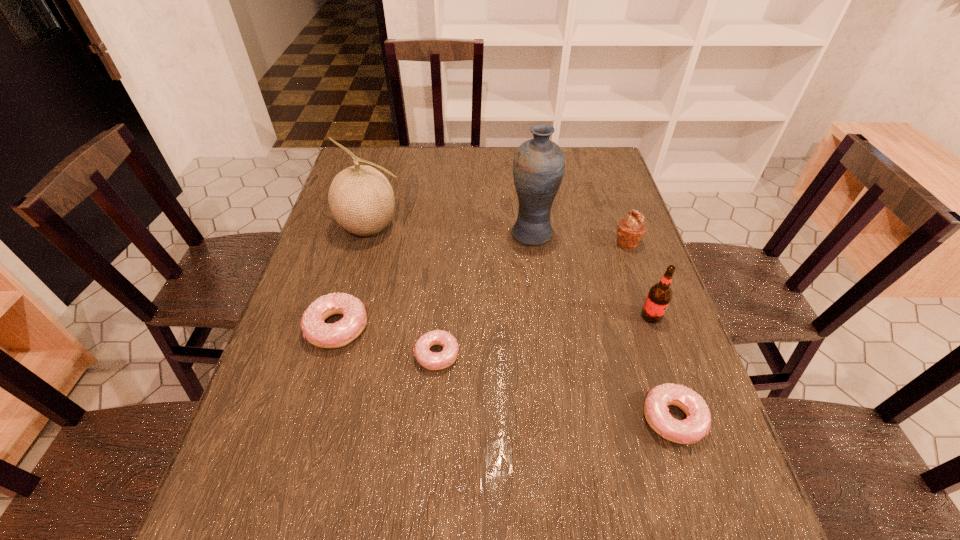
Locate an element on the screen. This screenshot has width=960, height=540. the third tallest object is located at coordinates (659, 296).

This screenshot has height=540, width=960. I want to click on vacant space located 0.120m on the front of the fifth tallest object, so click(316, 403).

Find the location of a particular element. blank space located 0.230m on the left of the second doughnut from right to left is located at coordinates (312, 355).

Image resolution: width=960 pixels, height=540 pixels. I want to click on vacant space located 0.050m on the left of the nearest object, so click(617, 419).

I want to click on vacant space situated on the back of the second tallest object, so click(x=391, y=155).

Identify the location of vacant space located on the left of the fourth object from left to right. (426, 233).

Locate an element on the screen. vacant region located 0.280m on the back of the fourth tallest object is located at coordinates (605, 179).

The height and width of the screenshot is (540, 960). What are the coordinates of `free space located on the back of the root beer` in the screenshot? It's located at (615, 213).

Find the location of a particular element. object at the near edge is located at coordinates (697, 424).

You are a GUI agent. You are given a task and a screenshot of the screen. Output one action in this format:
    pyautogui.click(x=<x>, y=<y>)
    Task: Click on the doughnut located in the left edge section of the desktop
    This screenshot has height=540, width=960.
    Given the screenshot: What is the action you would take?
    pyautogui.click(x=338, y=334)